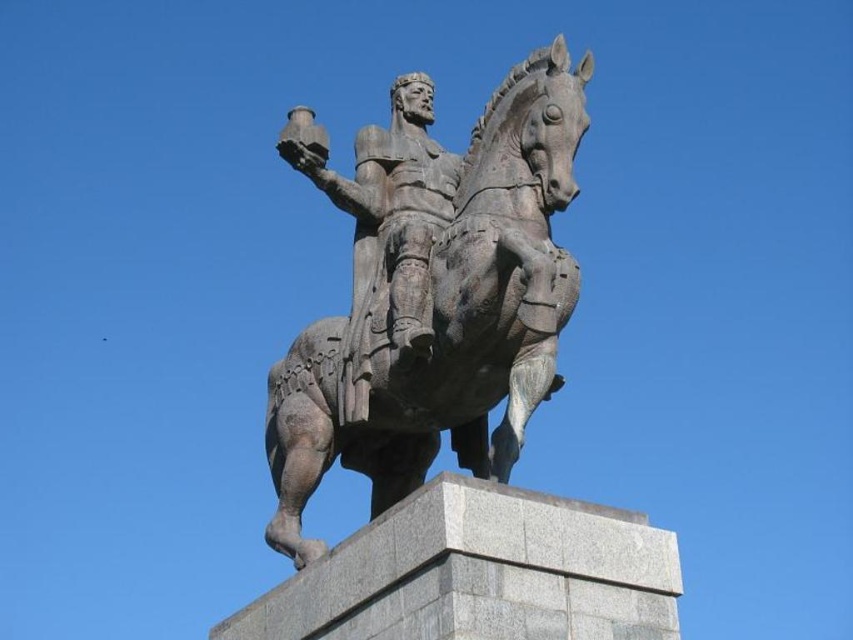
You are an art restorer examining the statue. You notice two points on the statue marked as point 1 and point 2. Point 1 is at coordinate (387,344) and point 2 is at (416,262). When looking at the statue from the front, which point is closer to you?

Point 1 is further to the viewer than point 2, so point 2 is closer to you.

You are an art conservator examining the bronze statue at center and the bronze armor at center in the image. Which object is positioned lower in the scene?

The bronze statue at center is positioned lower than the bronze armor at center.

You are an art conservator assessing the space requirements for transporting the bronze statue at center and bronze armor at center. Based on their sizes, which object requires more width for transportation?

The bronze statue at center might be wider than bronze armor at center, so it likely requires more width for transportation.